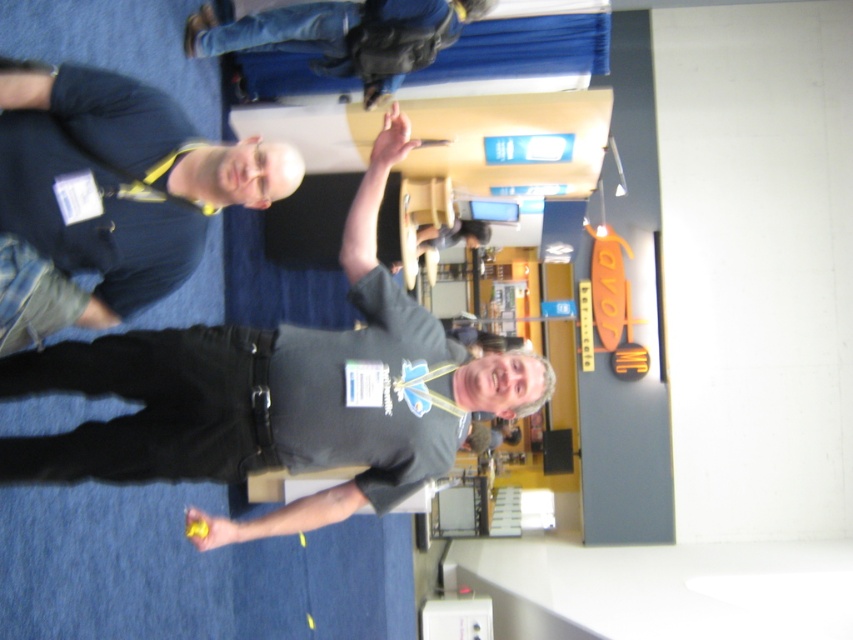
You are organizing a clothing donation drive and need to categorize items based on their size. You have two items in front of you labeled as jeans at upper center and smooth gray shirt at center. Which item is bigger in size?

The jeans at upper center is bigger in size compared to the smooth gray shirt at center.